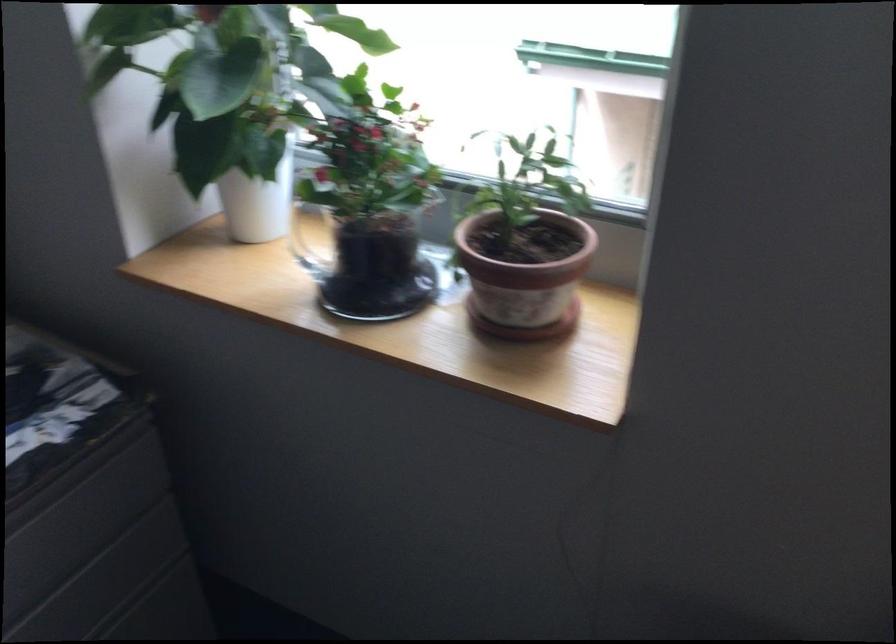
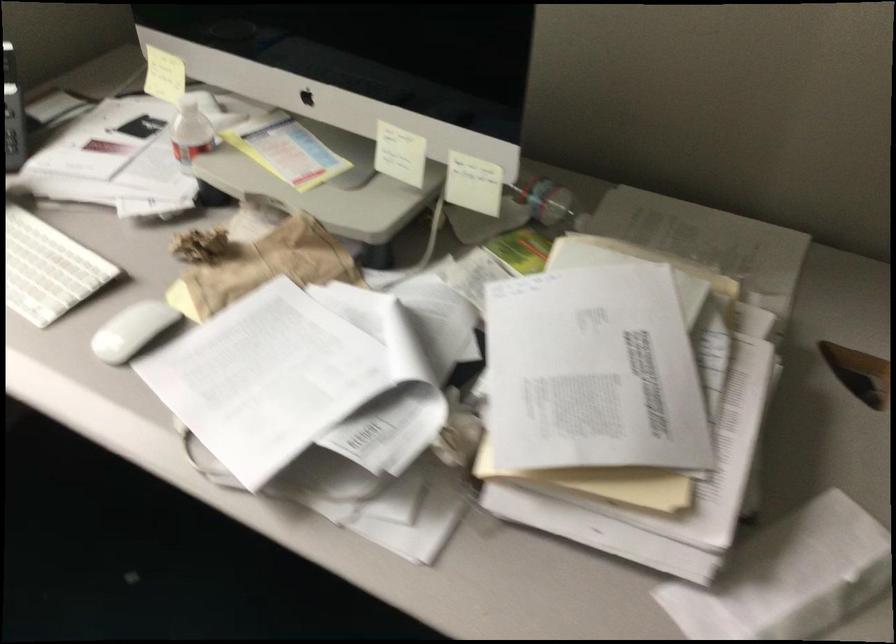
The first image is from the beginning of the video and the second image is from the end. How did the camera likely rotate when shooting the video?

The camera's rotation is toward right-down.